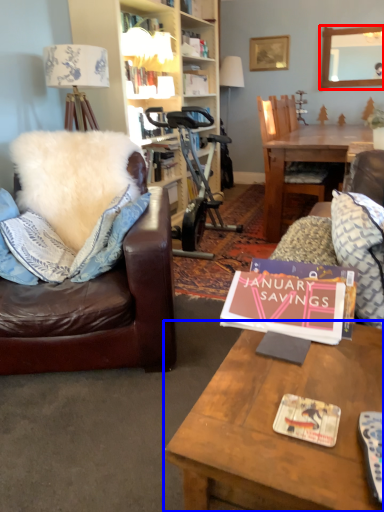
Question: Among these objects, which one is farthest to the camera, mirror (highlighted by a red box) or table (highlighted by a blue box)?

Choices:
 (A) mirror
 (B) table

Answer: (A)